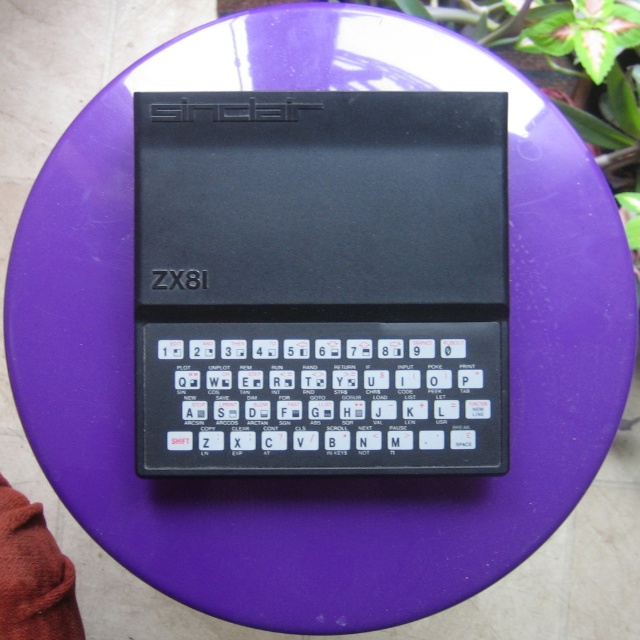
Question: Is the position of black plastic sinclair zx81 at center more distant than that of black plastic keyboard at center?

Choices:
 (A) no
 (B) yes

Answer: (A)

Question: Which of the following is the closest to the observer?

Choices:
 (A) (x=161, y=369)
 (B) (x=260, y=374)

Answer: (B)

Question: Does black plastic sinclair zx81 at center have a greater width compared to black plastic keyboard at center?

Choices:
 (A) yes
 (B) no

Answer: (A)

Question: Does black plastic sinclair zx81 at center appear on the left side of black plastic keyboard at center?

Choices:
 (A) no
 (B) yes

Answer: (A)

Question: Which object appears closest to the camera in this image?

Choices:
 (A) black plastic keyboard at center
 (B) black plastic sinclair zx81 at center

Answer: (B)